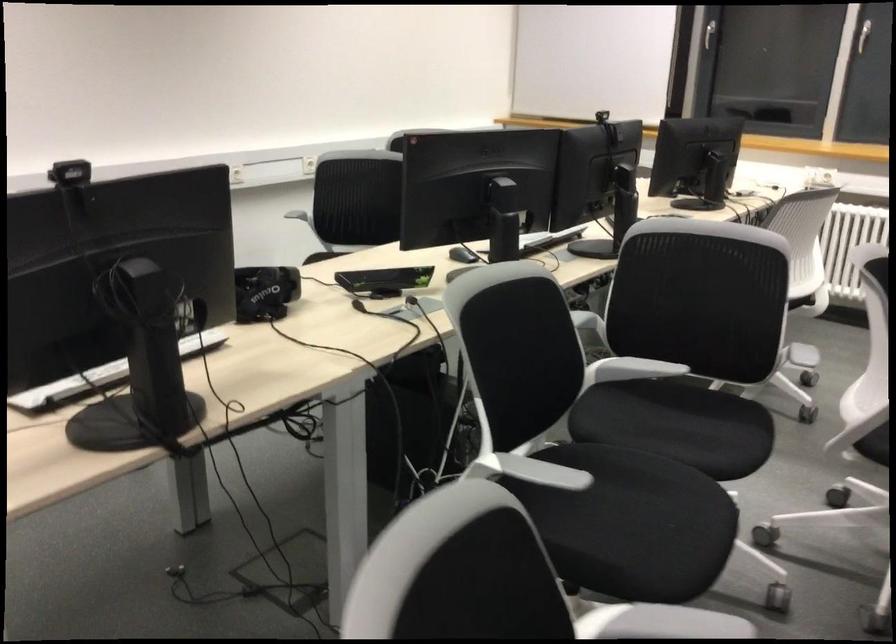
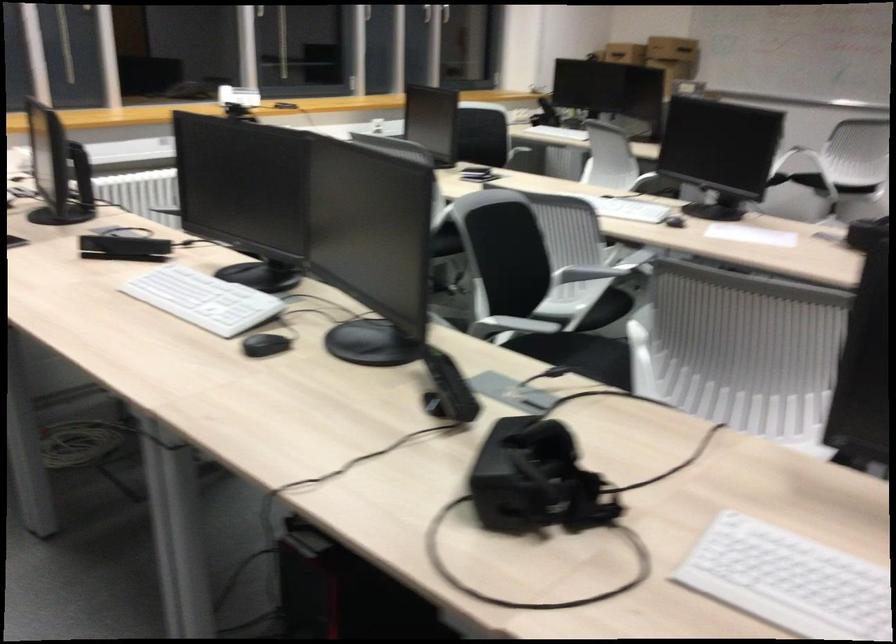
In the second image, find the point that corresponds to point (501, 290) in the first image.

(734, 277)